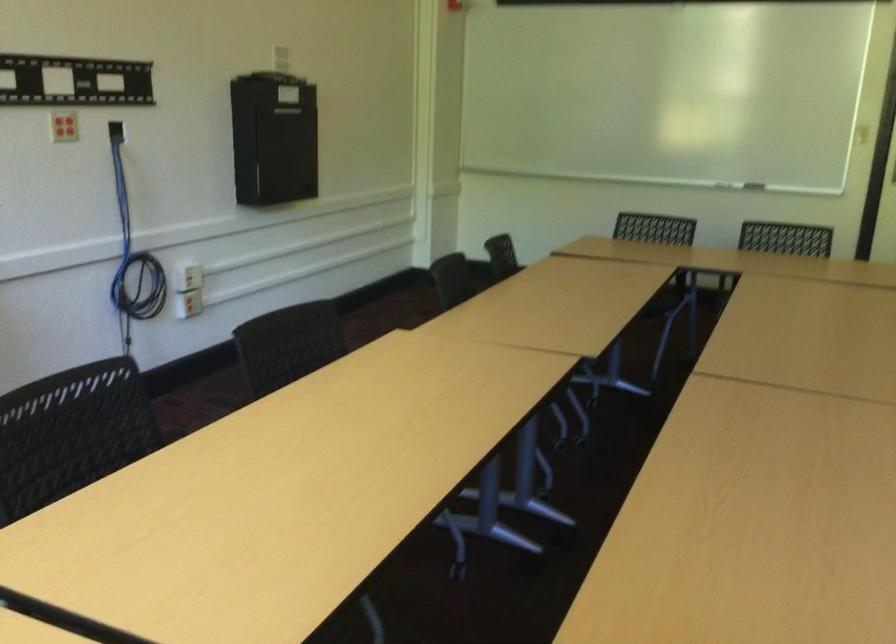
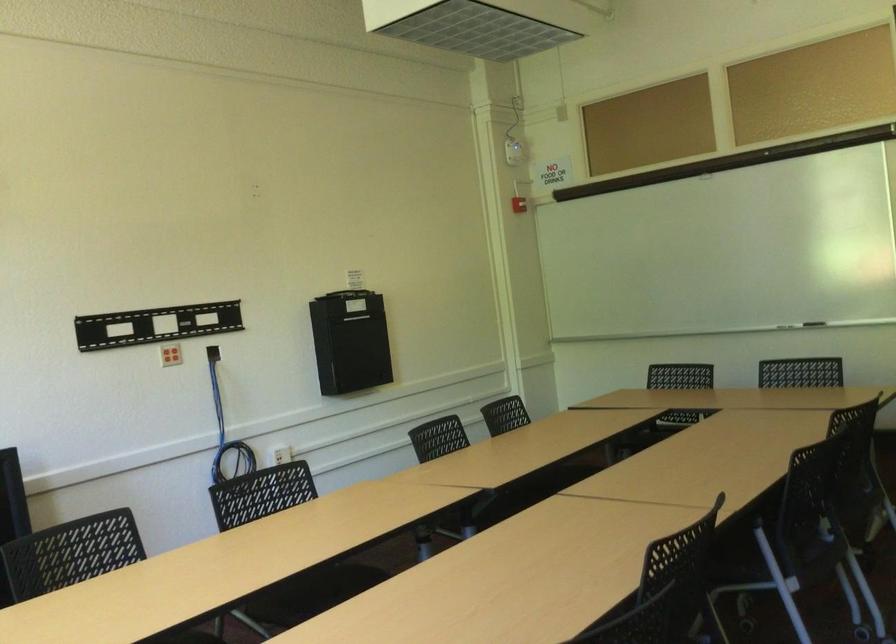
Where in the second image is the point corresponding to point 133,240 from the first image?

(226, 431)